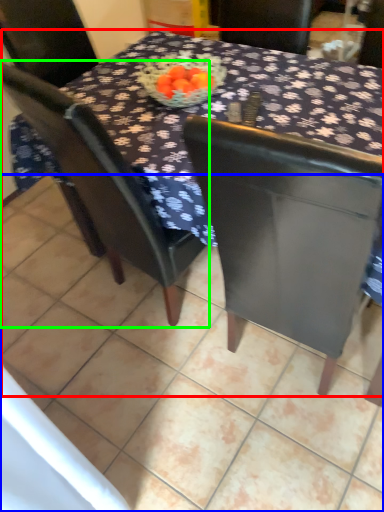
Question: Which object is positioned farthest from table (highlighted by a red box)? Select from tile (highlighted by a blue box) and chair (highlighted by a green box).

Choices:
 (A) tile
 (B) chair

Answer: (A)